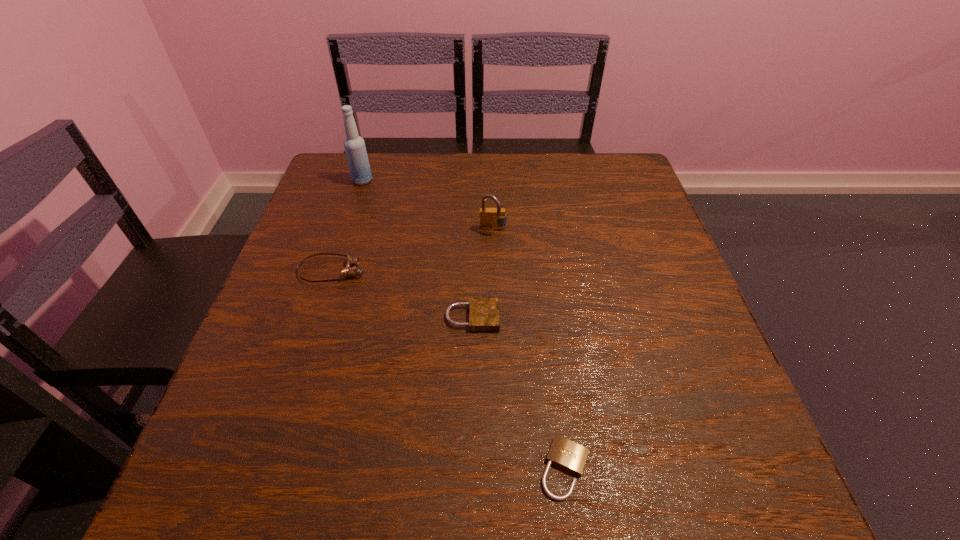
Find the location of a particular element. Image resolution: width=960 pixels, height=540 pixels. vacant area that satisfies the following two spatial constraints: 1. on the front lenses and sides of the nearest object; 2. on the left side of the third nearest object is located at coordinates (268, 468).

Where is `free location that satisfies the following two spatial constraints: 1. on the front lenses and sides of the third tallest object; 2. on the right side of the shortest padlock`? The height and width of the screenshot is (540, 960). free location that satisfies the following two spatial constraints: 1. on the front lenses and sides of the third tallest object; 2. on the right side of the shortest padlock is located at coordinates (268, 468).

This screenshot has width=960, height=540. I want to click on vacant point that satisfies the following two spatial constraints: 1. on the side with the combination dials of the second tallest object; 2. on the keyhole side of the fourth tallest object, so click(495, 317).

At what (x,y) coordinates should I click in order to perform the action: click on free space that satisfies the following two spatial constraints: 1. on the front side of the farthest object; 2. on the front lenses and sides of the third nearest object. Please return your answer as a coordinate pair (x, y). The image size is (960, 540). Looking at the image, I should click on (333, 271).